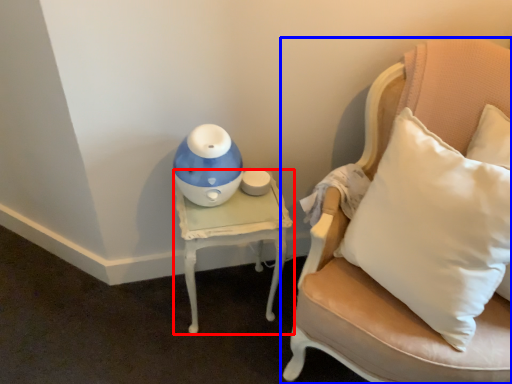
Question: Which of the following is the closest to the observer, table (highlighted by a red box) or chair (highlighted by a blue box)?

Choices:
 (A) table
 (B) chair

Answer: (B)